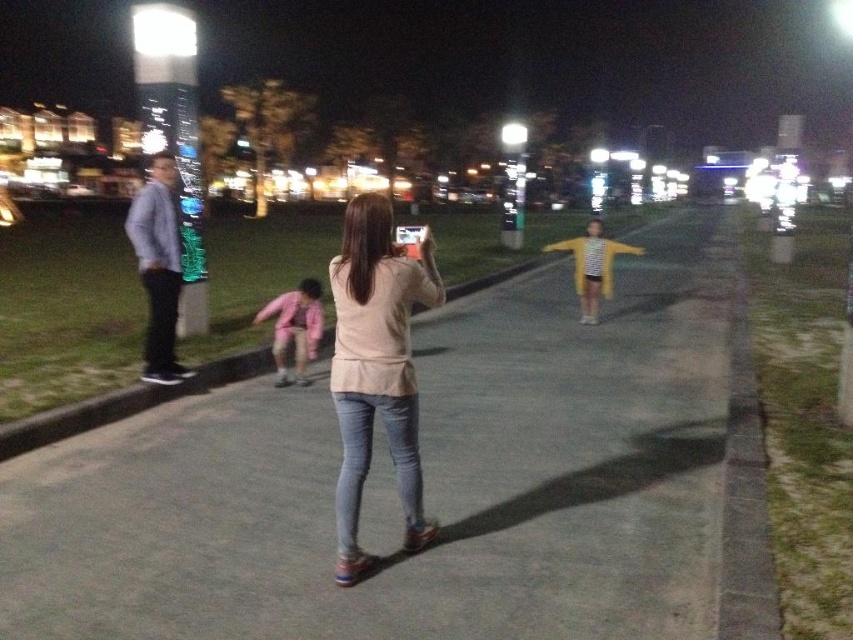
Does light beige sweater at center have a lesser height compared to pink fabric jacket at lower center?

In fact, light beige sweater at center may be taller than pink fabric jacket at lower center.

Is light beige sweater at center in front of pink fabric jacket at lower center?

Yes, light beige sweater at center is in front of pink fabric jacket at lower center.

The image size is (853, 640). I want to click on light beige sweater at center, so click(376, 369).

Who is taller, pink fabric jacket at lower center or yellow matte cardigan at center?

yellow matte cardigan at center is taller.

Is pink fabric jacket at lower center to the right of yellow matte cardigan at center from the viewer's perspective?

No, pink fabric jacket at lower center is not to the right of yellow matte cardigan at center.

You are a GUI agent. You are given a task and a screenshot of the screen. Output one action in this format:
    pyautogui.click(x=<x>, y=<y>)
    Task: Click on the pink fabric jacket at lower center
    
    Given the screenshot: What is the action you would take?
    click(x=294, y=328)

Does light beige sweater at center have a smaller size compared to gray concrete curb at center?

Correct, light beige sweater at center occupies less space than gray concrete curb at center.

Is light beige sweater at center to the left of gray concrete curb at center from the viewer's perspective?

Incorrect, light beige sweater at center is not on the left side of gray concrete curb at center.

At what (x,y) coordinates should I click in order to perform the action: click on light beige sweater at center. Please return your answer as a coordinate pair (x, y). Looking at the image, I should click on (376, 369).

I want to click on light beige sweater at center, so click(x=376, y=369).